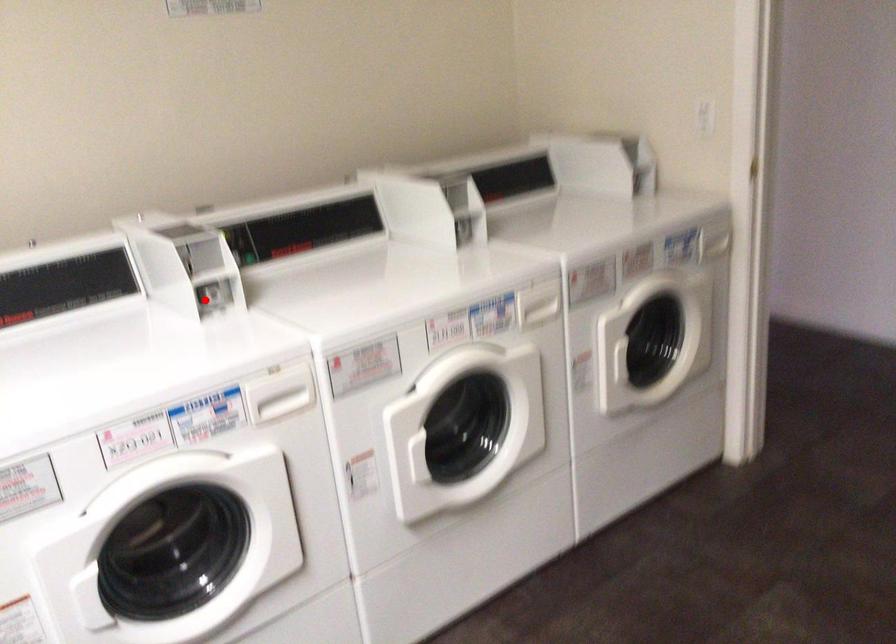
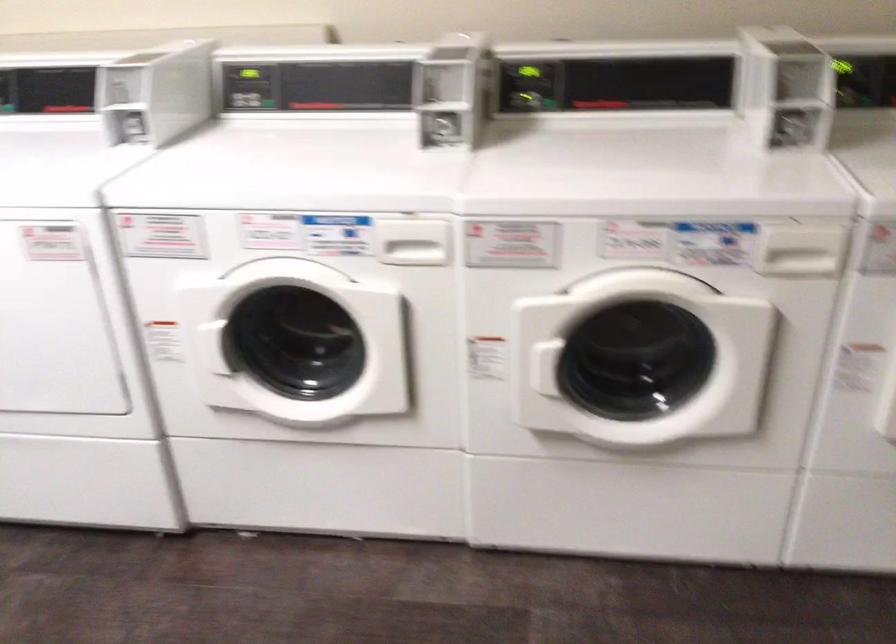
Where in the second image is the point corresponding to the highlighted location from the first image?

(435, 129)